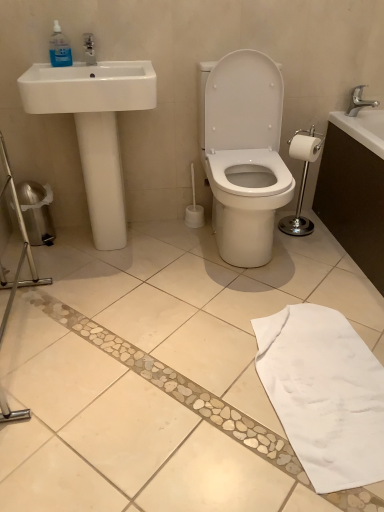
Question: Is silver metallic faucet at upper right oriented towards white matte toilet paper at right?

Choices:
 (A) yes
 (B) no

Answer: (B)

Question: Is silver metallic faucet at upper right to the right of white matte toilet paper at right from the viewer's perspective?

Choices:
 (A) no
 (B) yes

Answer: (B)

Question: Is silver metallic faucet at upper right next to white matte toilet paper at right?

Choices:
 (A) yes
 (B) no

Answer: (B)

Question: From a real-world perspective, is silver metallic faucet at upper right positioned over white matte toilet paper at right based on gravity?

Choices:
 (A) no
 (B) yes

Answer: (B)

Question: Is silver metallic faucet at upper right further to the viewer compared to white matte toilet paper at right?

Choices:
 (A) yes
 (B) no

Answer: (A)

Question: In the image, is white matte toilet paper at right on the left side or the right side of silver metallic toilet paper holder at right?

Choices:
 (A) left
 (B) right

Answer: (A)

Question: Considering the positions of point (311, 160) and point (347, 164), is point (311, 160) closer or farther from the camera than point (347, 164)?

Choices:
 (A) farther
 (B) closer

Answer: (A)

Question: Relative to silver metallic toilet paper holder at right, is white matte toilet paper at right in front or behind?

Choices:
 (A) behind
 (B) front

Answer: (A)

Question: Do you think white matte toilet paper at right is within silver metallic toilet paper holder at right, or outside of it?

Choices:
 (A) outside
 (B) inside

Answer: (A)

Question: Considering the positions of white glossy sink at left and silver metallic toilet paper holder at right in the image, is white glossy sink at left bigger or smaller than silver metallic toilet paper holder at right?

Choices:
 (A) big
 (B) small

Answer: (B)

Question: From a real-world perspective, is white glossy sink at left physically located above or below silver metallic toilet paper holder at right?

Choices:
 (A) above
 (B) below

Answer: (A)

Question: Would you say white glossy sink at left is to the left or to the right of silver metallic toilet paper holder at right in the picture?

Choices:
 (A) left
 (B) right

Answer: (A)

Question: From the image's perspective, is white glossy sink at left located above or below silver metallic toilet paper holder at right?

Choices:
 (A) below
 (B) above

Answer: (B)

Question: From the image's perspective, relative to transparent plastic bottle at upper left, is white matte toilet paper at right above or below?

Choices:
 (A) below
 (B) above

Answer: (A)

Question: From their relative heights in the image, would you say white matte toilet paper at right is taller or shorter than transparent plastic bottle at upper left?

Choices:
 (A) tall
 (B) short

Answer: (B)